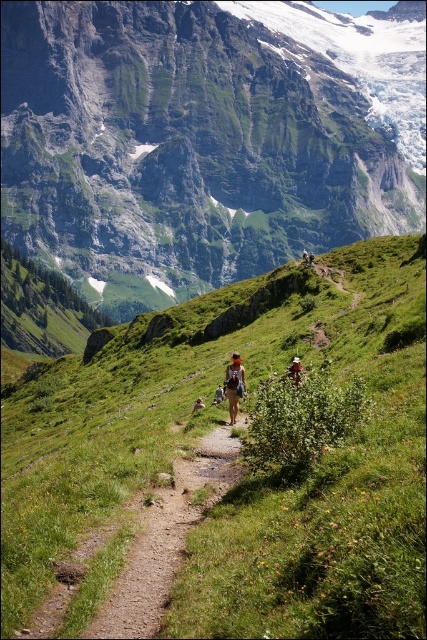
Question: Which is farther from the dirt path at center?

Choices:
 (A) green grassy at center
 (B) white cotton hat at center
 (C) rocky gray mountain at upper center
 (D) matte khaki shorts at center

Answer: (C)

Question: Observing the image, what is the correct spatial positioning of rocky gray mountain at upper center in reference to matte khaki shorts at center?

Choices:
 (A) above
 (B) below

Answer: (A)

Question: Among these objects, which one is farthest from the camera?

Choices:
 (A) white cotton hat at center
 (B) rocky gray mountain at upper center
 (C) khaki fabric backpack at center

Answer: (B)

Question: Does rocky gray mountain at upper center appear on the left side of khaki fabric backpack at center?

Choices:
 (A) yes
 (B) no

Answer: (B)

Question: Estimate the real-world distances between objects in this image. Which object is closer to the dirt path at center?

Choices:
 (A) white cotton hat at center
 (B) camouflage fabric backpack at center

Answer: (A)

Question: Considering the relative positions of dirt path at center and khaki fabric backpack at center in the image provided, where is dirt path at center located with respect to khaki fabric backpack at center?

Choices:
 (A) right
 (B) left

Answer: (A)